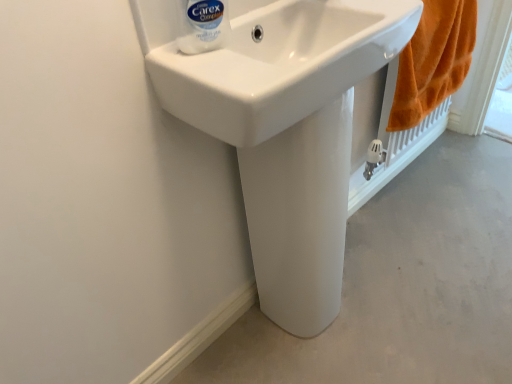
Question: Is orange fluffy towel at right far away from white smooth pedestal at center?

Choices:
 (A) no
 (B) yes

Answer: (A)

Question: Does orange fluffy towel at right have a lesser height compared to white smooth pedestal at center?

Choices:
 (A) no
 (B) yes

Answer: (A)

Question: Is orange fluffy towel at right completely or partially outside of white smooth pedestal at center?

Choices:
 (A) no
 (B) yes

Answer: (B)

Question: From a real-world perspective, is orange fluffy towel at right beneath white smooth pedestal at center?

Choices:
 (A) yes
 (B) no

Answer: (B)

Question: Considering the relative positions of orange fluffy towel at right and white smooth pedestal at center in the image provided, is orange fluffy towel at right to the left of white smooth pedestal at center from the viewer's perspective?

Choices:
 (A) yes
 (B) no

Answer: (A)

Question: Do you think white glossy pedestal at center is within white plastic bottle at upper center, or outside of it?

Choices:
 (A) outside
 (B) inside

Answer: (A)

Question: From their relative heights in the image, would you say white glossy pedestal at center is taller or shorter than white plastic bottle at upper center?

Choices:
 (A) short
 (B) tall

Answer: (B)

Question: Is point (326, 109) positioned closer to the camera than point (184, 8)?

Choices:
 (A) closer
 (B) farther

Answer: (B)

Question: Would you say white glossy pedestal at center is to the left or to the right of white plastic bottle at upper center in the picture?

Choices:
 (A) left
 (B) right

Answer: (B)

Question: In terms of height, does orange fluffy towel at right look taller or shorter compared to white glossy pedestal at center?

Choices:
 (A) tall
 (B) short

Answer: (B)

Question: From a real-world perspective, is orange fluffy towel at right positioned above or below white glossy pedestal at center?

Choices:
 (A) above
 (B) below

Answer: (A)

Question: In the image, is orange fluffy towel at right on the left side or the right side of white glossy pedestal at center?

Choices:
 (A) right
 (B) left

Answer: (A)

Question: Looking at their shapes, would you say orange fluffy towel at right is wider or thinner than white glossy pedestal at center?

Choices:
 (A) wide
 (B) thin

Answer: (B)

Question: From a real-world perspective, relative to white plastic bottle at upper center, is white glossy sink at center vertically above or below?

Choices:
 (A) below
 (B) above

Answer: (A)

Question: Relative to white plastic bottle at upper center, is white glossy sink at center in front or behind?

Choices:
 (A) behind
 (B) front

Answer: (B)